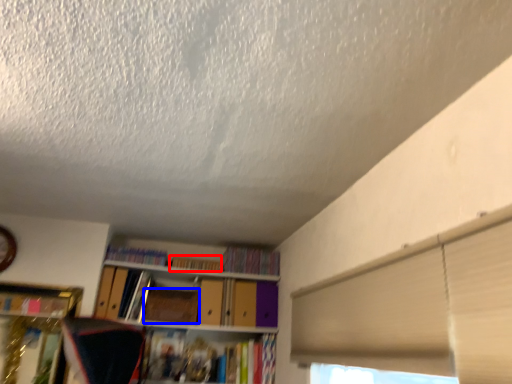
Question: Which object appears closest to the camera in this image, book (highlighted by a red box) or paperback book (highlighted by a blue box)?

Choices:
 (A) book
 (B) paperback book

Answer: (B)